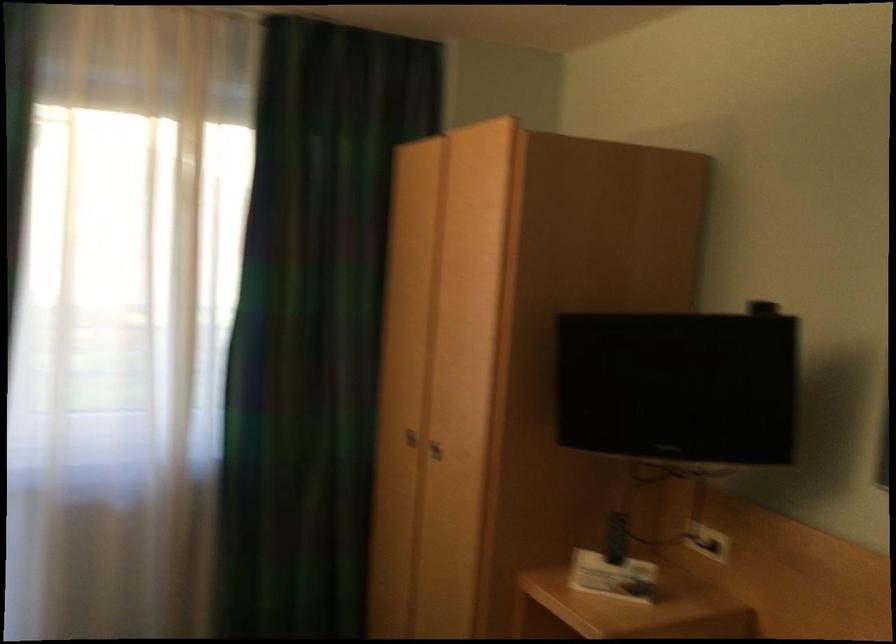
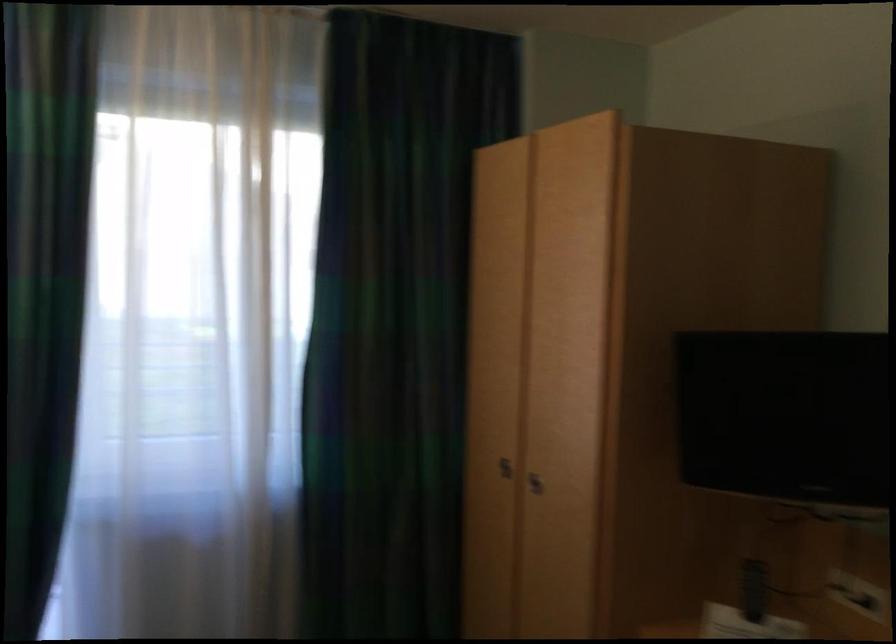
In the second image, find the point that corresponds to point 412,440 in the first image.

(504, 468)